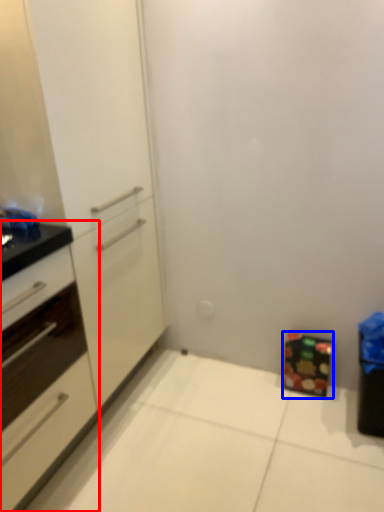
Question: Which point is closer to the camera, cabinetry (highlighted by a red box) or cabinetry (highlighted by a blue box)?

Choices:
 (A) cabinetry
 (B) cabinetry

Answer: (A)